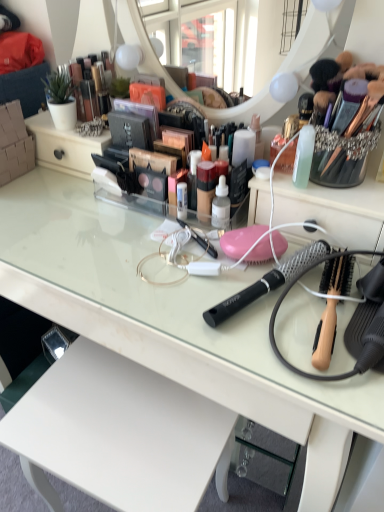
Question: Considering the relative positions of wooden-handled hairbrush at right, the first brush when ordered from right to left, and clear glass desk at center in the image provided, is wooden-handled hairbrush at right, the first brush when ordered from right to left, to the right of clear glass desk at center from the viewer's perspective?

Choices:
 (A) yes
 (B) no

Answer: (A)

Question: Considering the relative positions of wooden-handled hairbrush at right, the first brush when ordered from right to left, and clear glass desk at center in the image provided, is wooden-handled hairbrush at right, the first brush when ordered from right to left, in front of clear glass desk at center?

Choices:
 (A) no
 (B) yes

Answer: (A)

Question: From the image's perspective, is wooden-handled hairbrush at right, the 2th brush in the left-to-right sequence, below clear glass desk at center?

Choices:
 (A) yes
 (B) no

Answer: (B)

Question: Does wooden-handled hairbrush at right, the first brush when ordered from right to left, turn towards clear glass desk at center?

Choices:
 (A) yes
 (B) no

Answer: (B)

Question: Considering the relative sizes of wooden-handled hairbrush at right, the 2th brush in the left-to-right sequence, and clear glass desk at center in the image provided, is wooden-handled hairbrush at right, the 2th brush in the left-to-right sequence, smaller than clear glass desk at center?

Choices:
 (A) no
 (B) yes

Answer: (B)

Question: Is wooden-handled hairbrush at right, the first brush when ordered from right to left, wider than clear glass desk at center?

Choices:
 (A) no
 (B) yes

Answer: (A)

Question: From the image's perspective, is black mesh hairbrush at center, placed as the first brush when sorted from left to right, on top of wooden-handled hairbrush at right, the 2th brush in the left-to-right sequence?

Choices:
 (A) no
 (B) yes

Answer: (B)

Question: Is black mesh hairbrush at center, placed as the first brush when sorted from left to right, wider than wooden-handled hairbrush at right, the 2th brush in the left-to-right sequence?

Choices:
 (A) yes
 (B) no

Answer: (A)

Question: Does black mesh hairbrush at center, placed as the first brush when sorted from left to right, come behind wooden-handled hairbrush at right, the 2th brush in the left-to-right sequence?

Choices:
 (A) no
 (B) yes

Answer: (B)

Question: Is black mesh hairbrush at center, placed as the first brush when sorted from left to right, positioned beyond the bounds of wooden-handled hairbrush at right, the 2th brush in the left-to-right sequence?

Choices:
 (A) yes
 (B) no

Answer: (A)

Question: Could wooden-handled hairbrush at right, the 2th brush in the left-to-right sequence, be considered to be inside black mesh hairbrush at center, placed as the first brush when sorted from left to right?

Choices:
 (A) yes
 (B) no

Answer: (B)

Question: Is black mesh hairbrush at center, placed as the first brush when sorted from left to right, next to wooden-handled hairbrush at right, the first brush when ordered from right to left?

Choices:
 (A) no
 (B) yes

Answer: (B)

Question: Are wooden-handled hairbrush at right, the 2th brush in the left-to-right sequence, and metallic gold makeup at upper left far apart?

Choices:
 (A) yes
 (B) no

Answer: (B)